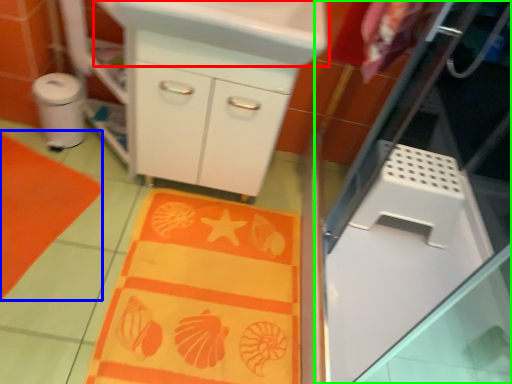
Question: Estimate the real-world distances between objects in this image. Which object is closer to sink (highlighted by a red box), beach towel (highlighted by a blue box) or screen door (highlighted by a green box)?

Choices:
 (A) beach towel
 (B) screen door

Answer: (B)